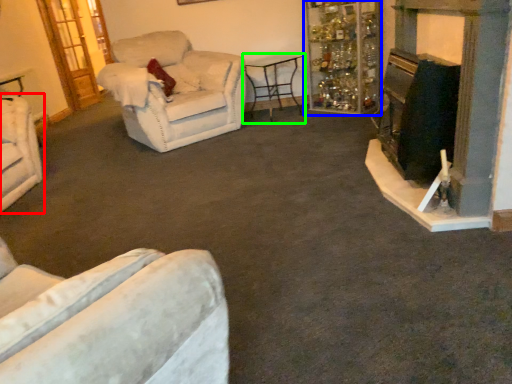
Question: Based on their relative distances, which object is farther from chair (highlighted by a red box)? Choose from shelf (highlighted by a blue box) and table (highlighted by a green box).

Choices:
 (A) shelf
 (B) table

Answer: (A)